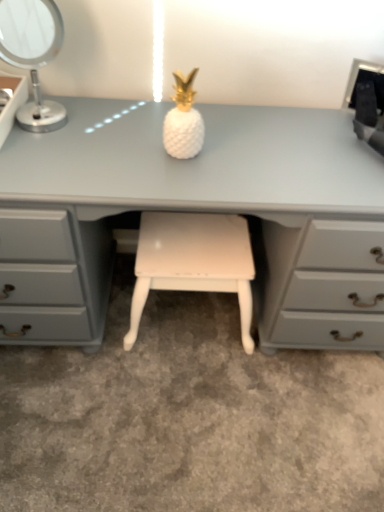
I want to click on free location above white painted wood stool at center (from a real-world perspective), so click(x=191, y=244).